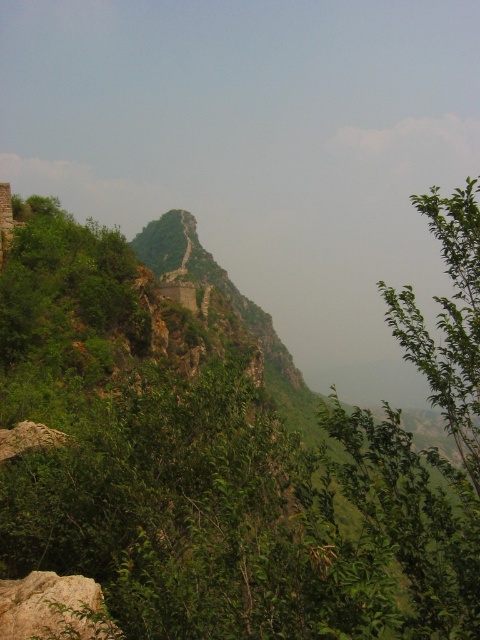
Question: Can you confirm if green leafy tree at right is thinner than smooth gray rock at lower left?

Choices:
 (A) yes
 (B) no

Answer: (B)

Question: Is green leafy tree at right smaller than smooth gray rock at lower left?

Choices:
 (A) no
 (B) yes

Answer: (A)

Question: In this image, where is green leafy tree at right located relative to smooth gray rock at lower left?

Choices:
 (A) left
 (B) right

Answer: (B)

Question: Which point is farther from the camera taking this photo?

Choices:
 (A) (35, 637)
 (B) (442, 198)

Answer: (B)

Question: Among these objects, which one is farthest from the camera?

Choices:
 (A) smooth gray rock at lower left
 (B) green leafy tree at right

Answer: (B)